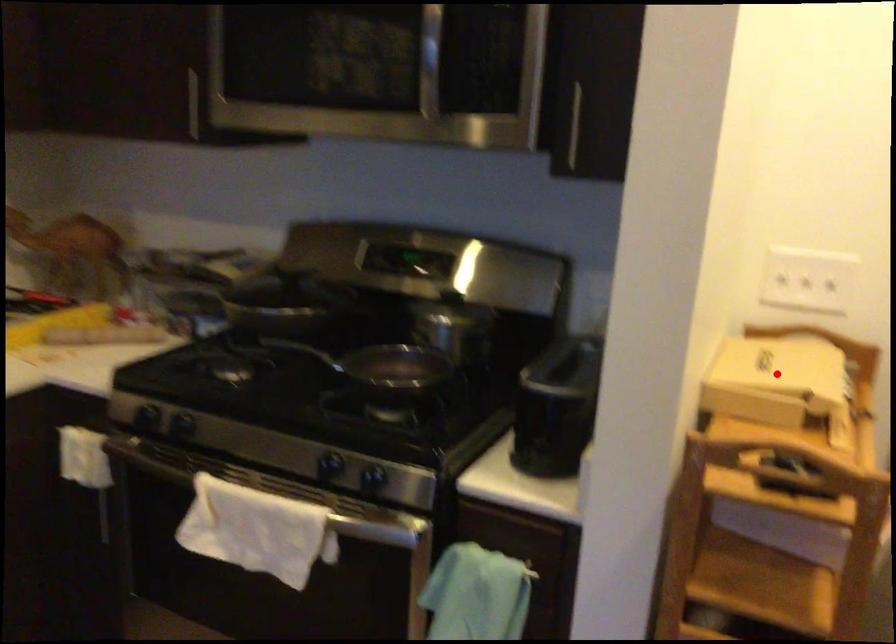
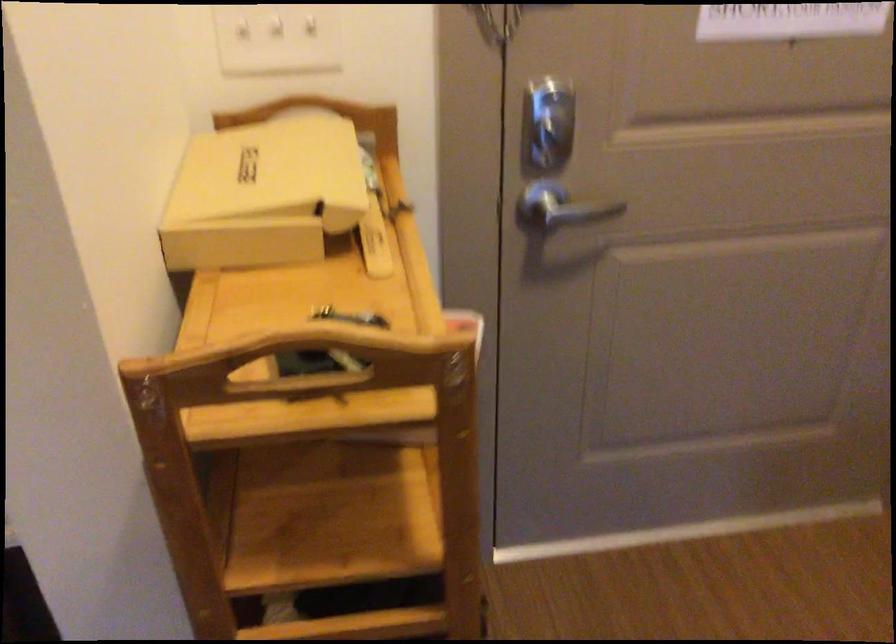
Question: A red point is marked in image1. In image2, is the corresponding 3D point closer to the camera or farther? Reply with the corresponding letter.

Choices:
 (A) The corresponding 3D point is closer.
 (B) The corresponding 3D point is farther.

Answer: (A)